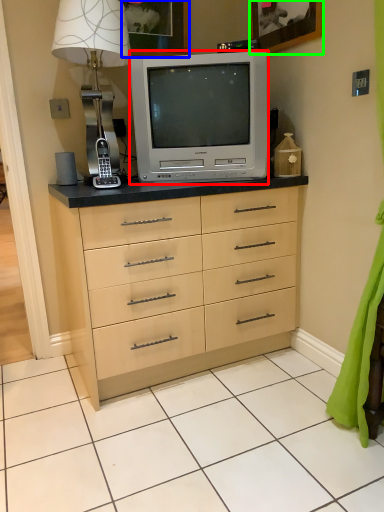
Question: Which is nearer to the television (highlighted by a red box)? picture frame (highlighted by a blue box) or picture frame (highlighted by a green box).

Choices:
 (A) picture frame
 (B) picture frame

Answer: (B)